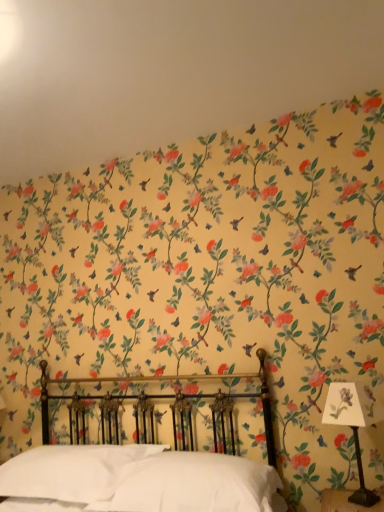
Question: Should I look upward or downward to see polished brass bed at center?

Choices:
 (A) up
 (B) down

Answer: (B)

Question: From a real-world perspective, is polished brass bed at center positioned over white paper at right based on gravity?

Choices:
 (A) no
 (B) yes

Answer: (A)

Question: From a real-world perspective, is polished brass bed at center under white paper at right?

Choices:
 (A) no
 (B) yes

Answer: (B)

Question: Does polished brass bed at center appear on the right side of white paper at right?

Choices:
 (A) yes
 (B) no

Answer: (B)

Question: From the image's perspective, is polished brass bed at center under white paper at right?

Choices:
 (A) yes
 (B) no

Answer: (A)

Question: Does polished brass bed at center have a lesser width compared to white paper at right?

Choices:
 (A) no
 (B) yes

Answer: (A)

Question: From the image's perspective, is polished brass bed at center on white paper at right?

Choices:
 (A) no
 (B) yes

Answer: (A)

Question: Is polished brass bed at center facing away from floral wallpaper at upper center?

Choices:
 (A) no
 (B) yes

Answer: (A)

Question: From the image's perspective, is polished brass bed at center on top of floral wallpaper at upper center?

Choices:
 (A) yes
 (B) no

Answer: (B)

Question: Considering the relative sizes of polished brass bed at center and floral wallpaper at upper center in the image provided, is polished brass bed at center wider than floral wallpaper at upper center?

Choices:
 (A) yes
 (B) no

Answer: (A)

Question: From the image's perspective, would you say polished brass bed at center is shown under floral wallpaper at upper center?

Choices:
 (A) yes
 (B) no

Answer: (A)

Question: Can you confirm if polished brass bed at center is smaller than floral wallpaper at upper center?

Choices:
 (A) yes
 (B) no

Answer: (B)

Question: Considering the relative sizes of polished brass bed at center and floral wallpaper at upper center in the image provided, is polished brass bed at center bigger than floral wallpaper at upper center?

Choices:
 (A) yes
 (B) no

Answer: (A)

Question: Is white soft pillow at center, which is the second pillow from left to right, to the right of polished brass bed at center from the viewer's perspective?

Choices:
 (A) yes
 (B) no

Answer: (A)